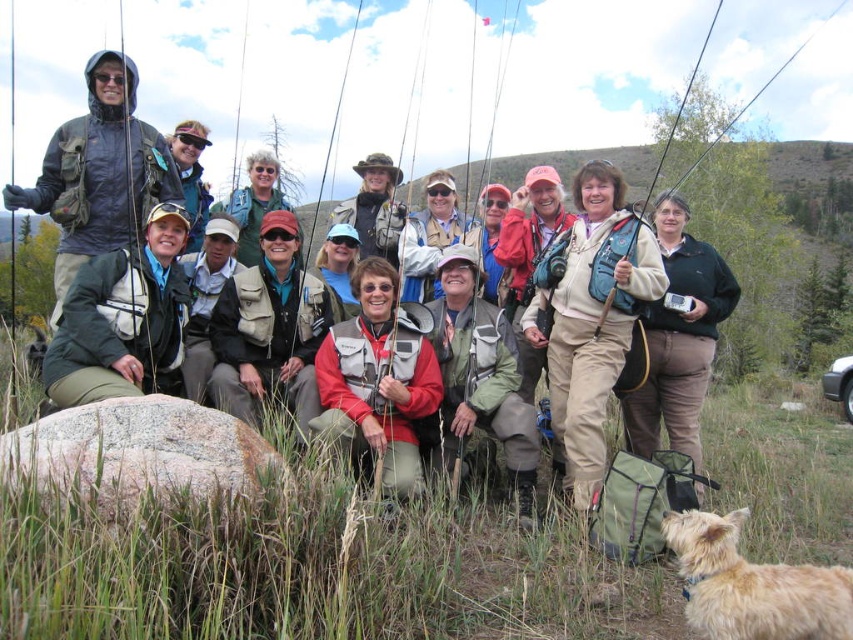
Question: Which object is closer to the camera taking this photo?

Choices:
 (A) dark green jacket at center
 (B) gray granite rock at lower left
 (C) light brown fur at lower right

Answer: (B)

Question: Does green fabric jacket at lower left have a smaller size compared to matte red jacket at center?

Choices:
 (A) no
 (B) yes

Answer: (B)

Question: Can you confirm if matte black jacket at upper left is smaller than matte red jacket at center?

Choices:
 (A) yes
 (B) no

Answer: (B)

Question: Which object is positioned farthest from the light brown fur at lower right?

Choices:
 (A) matte red jacket at center
 (B) green fabric jacket at lower left

Answer: (B)

Question: Is matte red jacket at center above light brown fur at lower right?

Choices:
 (A) yes
 (B) no

Answer: (A)

Question: Which point is closer to the camera?

Choices:
 (A) (76, 273)
 (B) (601, 456)
 (C) (415, 355)

Answer: (A)